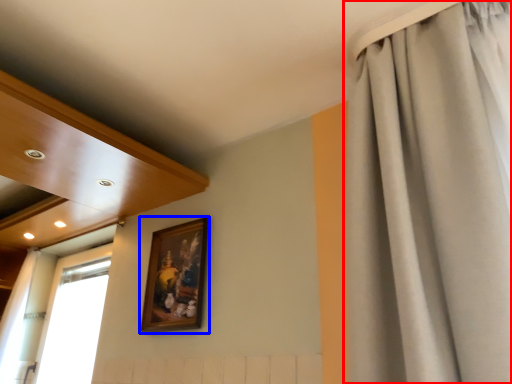
Question: Which object appears farthest to the camera in this image, curtain (highlighted by a red box) or picture frame (highlighted by a blue box)?

Choices:
 (A) curtain
 (B) picture frame

Answer: (B)